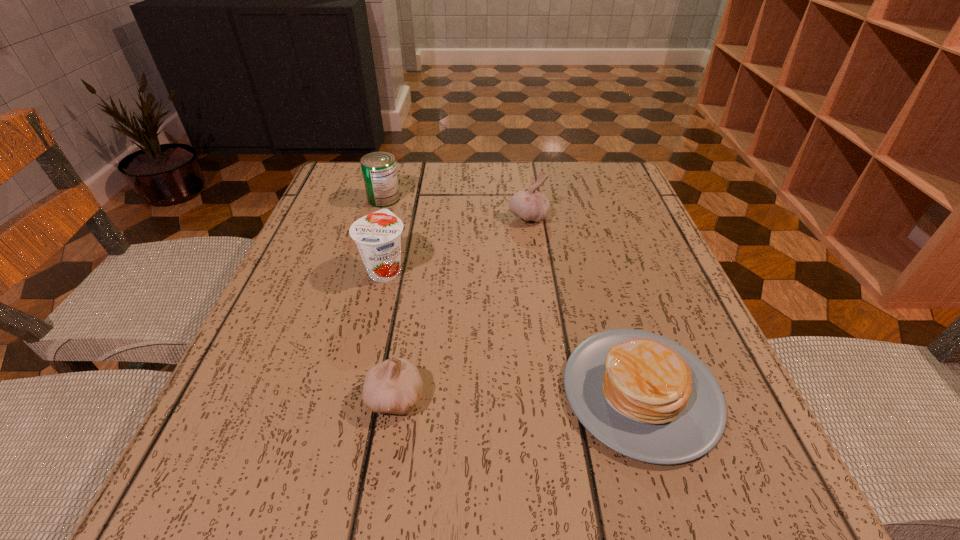
You are a GUI agent. You are given a task and a screenshot of the screen. Output one action in this format:
    pyautogui.click(x=<x>, y=<y>)
    Task: Click on the free space between the right garlic and the pancake
    
    Given the screenshot: What is the action you would take?
    pyautogui.click(x=585, y=305)

Identify the location of free space between the yogurt and the shortest object. This screenshot has width=960, height=540. (513, 330).

The width and height of the screenshot is (960, 540). In order to click on free space between the can and the nearer garlic in this screenshot , I will do `click(390, 298)`.

In order to click on free space between the pancake and the third nearest object in this screenshot , I will do `click(513, 330)`.

This screenshot has width=960, height=540. I want to click on empty space that is in between the right garlic and the shorter garlic, so (462, 307).

At what (x,y) coordinates should I click in order to perform the action: click on object that stands as the third closest to the can. Please return your answer as a coordinate pair (x, y). The height and width of the screenshot is (540, 960). Looking at the image, I should click on (394, 386).

Locate which object is the closest to the second shortest object. Please provide its 2D coordinates. Your answer should be formatted as a tuple, i.e. [(x, y)], where the tuple contains the x and y coordinates of a point satisfying the conditions above.

[(378, 235)]

You are a GUI agent. You are given a task and a screenshot of the screen. Output one action in this format:
    pyautogui.click(x=<x>, y=<y>)
    Task: Click on the free space that satisfies the following two spatial constraints: 1. on the front side of the farther garlic; 2. on the right side of the can
    The image size is (960, 540).
    Given the screenshot: What is the action you would take?
    pyautogui.click(x=378, y=217)

At what (x,y) coordinates should I click in order to perform the action: click on vacant area that satisfies the following two spatial constraints: 1. on the front side of the can; 2. on the right side of the taller garlic. Please return your answer as a coordinate pair (x, y). Looking at the image, I should click on (378, 217).

The width and height of the screenshot is (960, 540). Identify the location of free space that satisfies the following two spatial constraints: 1. on the front side of the can; 2. on the right side of the third nearest object. (363, 268).